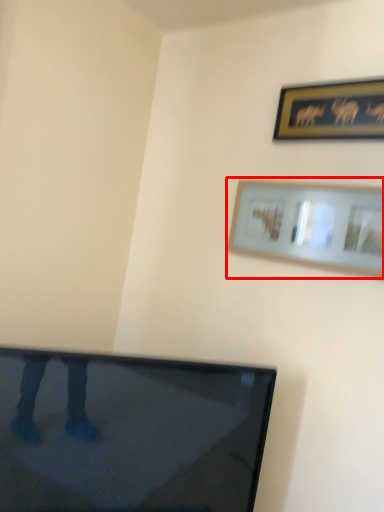
Question: From the image's perspective, where is picture frame (annotated by the red box) located in relation to picture frame in the image?

Choices:
 (A) below
 (B) above

Answer: (A)